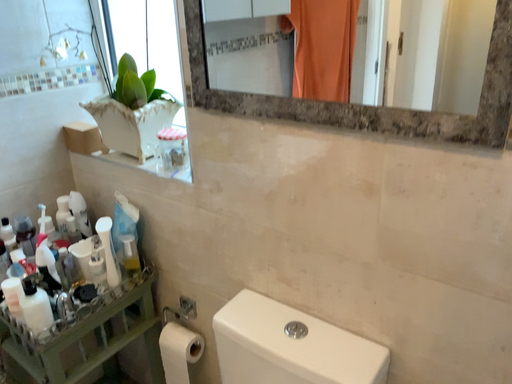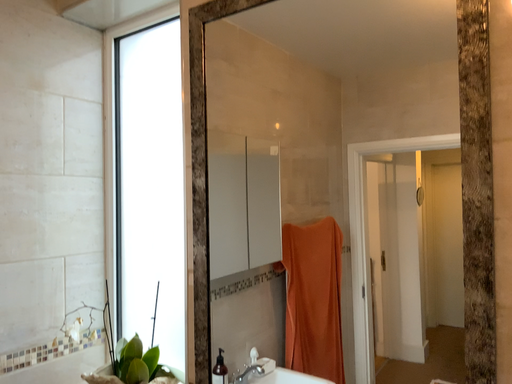
Question: Which way did the camera rotate in the video?

Choices:
 (A) rotated upward
 (B) rotated downward

Answer: (A)